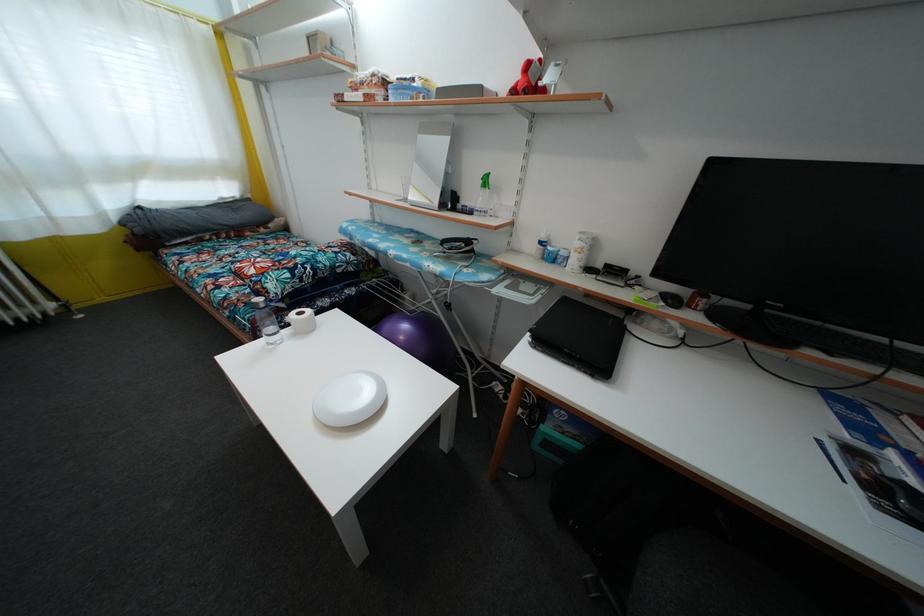
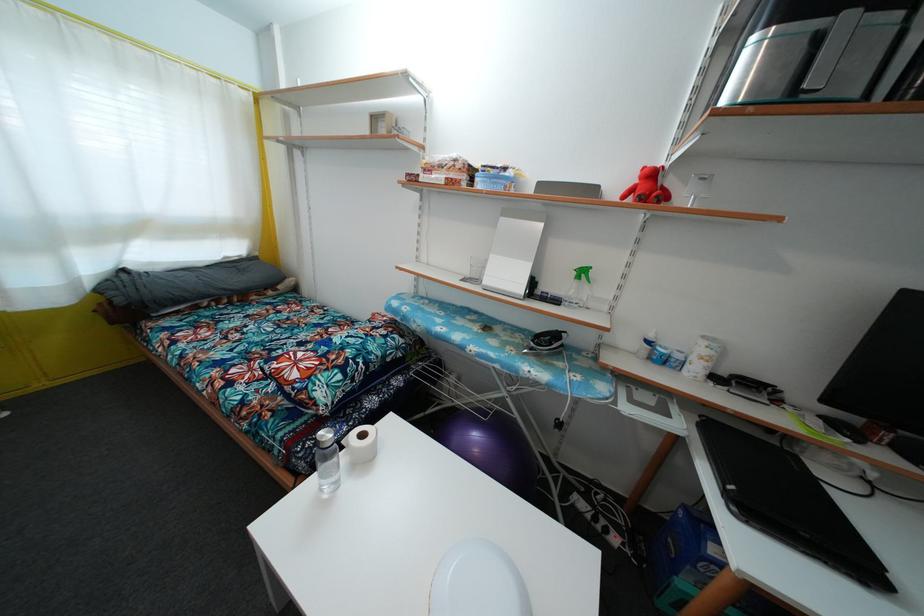
Question: How did the camera likely rotate?

Choices:
 (A) Left
 (B) Right
 (C) Up
 (D) Down

Answer: (C)